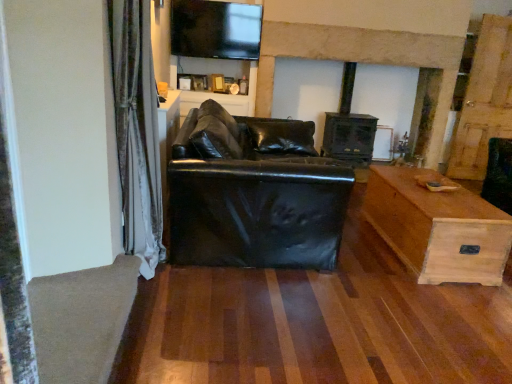
You are a GUI agent. You are given a task and a screenshot of the screen. Output one action in this format:
    pyautogui.click(x=<x>, y=<y>)
    Task: Click on the vacant region in front of wooden chest at right
    
    Given the screenshot: What is the action you would take?
    pyautogui.click(x=424, y=308)